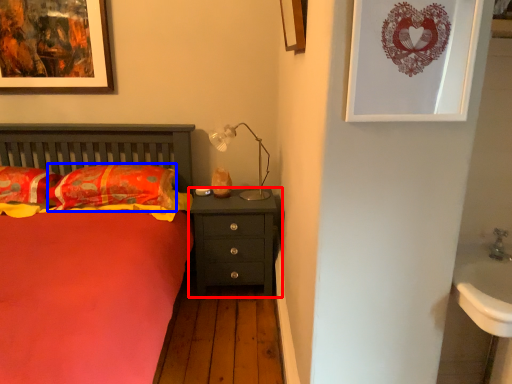
Question: Which object appears closest to the camera in this image, nightstand (highlighted by a red box) or pillow (highlighted by a blue box)?

Choices:
 (A) nightstand
 (B) pillow

Answer: (B)